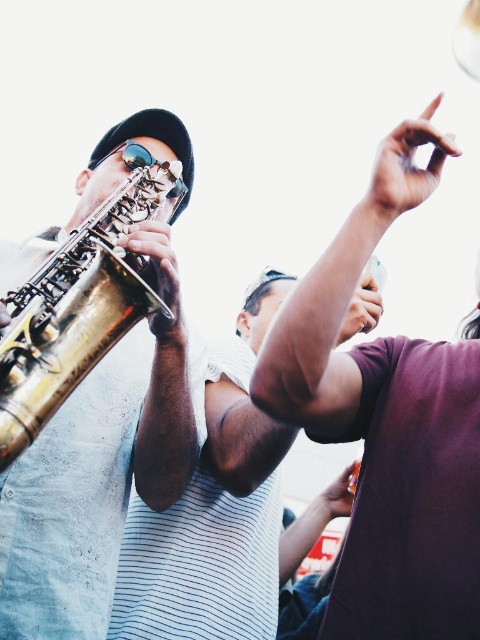
Question: Can you confirm if dark purple shirt at upper right is positioned to the right of gold polished trumpet at left?

Choices:
 (A) no
 (B) yes

Answer: (B)

Question: Among these points, which one is farthest from the camera?

Choices:
 (A) (418, 193)
 (B) (119, 298)

Answer: (A)

Question: From the image, what is the correct spatial relationship of dark purple shirt at upper right in relation to gold polished trumpet at left?

Choices:
 (A) left
 (B) right

Answer: (B)

Question: Can you confirm if dark purple shirt at upper right is positioned below gold polished trumpet at left?

Choices:
 (A) no
 (B) yes

Answer: (B)

Question: Which point is closer to the camera?

Choices:
 (A) gold polished trumpet at left
 (B) dark purple shirt at upper right

Answer: (B)